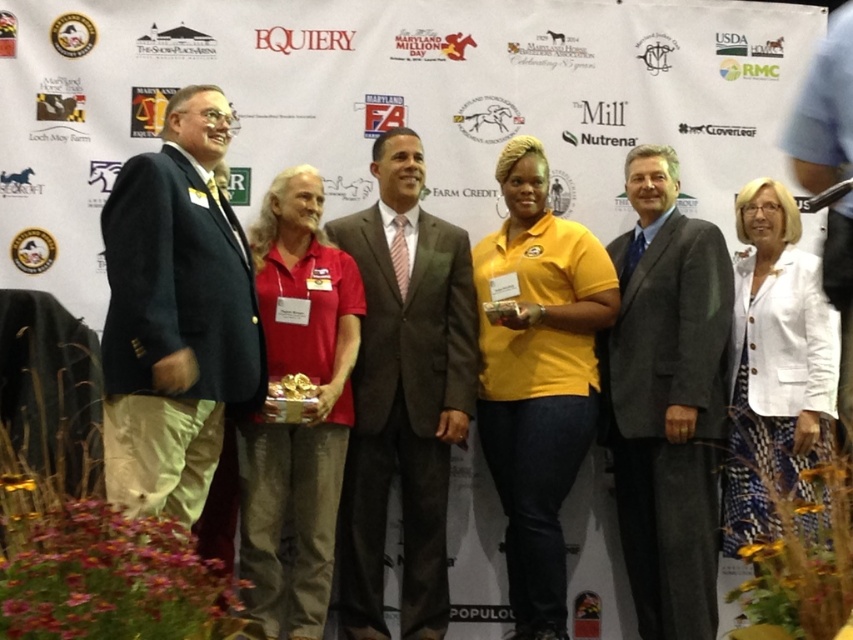
Is brown textured suit at center to the left of gray suit at center from the viewer's perspective?

Indeed, brown textured suit at center is positioned on the left side of gray suit at center.

Which is in front, point (459, 384) or point (647, 339)?

Positioned in front is point (647, 339).

This screenshot has height=640, width=853. Describe the element at coordinates (404, 394) in the screenshot. I see `brown textured suit at center` at that location.

Image resolution: width=853 pixels, height=640 pixels. I want to click on brown textured suit at center, so click(404, 394).

Who is more forward, (229, 385) or (624, 296)?

Point (229, 385)

How much distance is there between dark blue suit at left and gray suit at center?

2.15 meters

Is point (227, 250) closer to camera compared to point (668, 480)?

Yes, point (227, 250) is in front of point (668, 480).

Where is `dark blue suit at left`? dark blue suit at left is located at coordinates (175, 314).

Which of these two, dark blue suit at left or brown textured suit at center, stands shorter?

dark blue suit at left is shorter.

Does dark blue suit at left have a lesser width compared to brown textured suit at center?

Correct, dark blue suit at left's width is less than brown textured suit at center's.

Identify the location of dark blue suit at left. (175, 314).